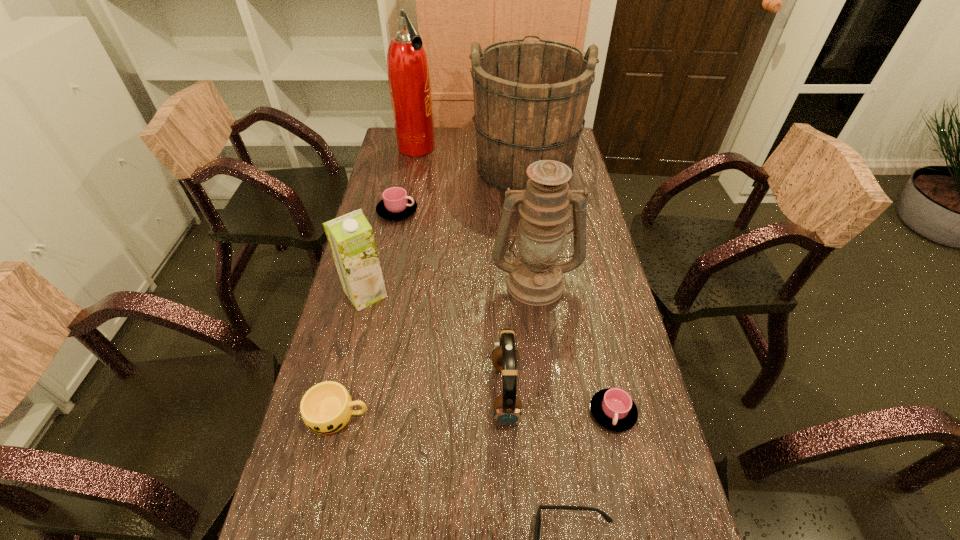
What are the coordinates of `the shortest cup` in the screenshot? It's located at (613, 408).

I want to click on the smaller pink cup, so click(613, 408).

Find the location of a particular element. blank space located 0.220m on the right of the fire extinguisher is located at coordinates (488, 148).

Locate an element on the screen. free space located on the back of the bucket is located at coordinates (520, 127).

Locate an element on the screen. The height and width of the screenshot is (540, 960). vacant space located on the back of the oil lamp is located at coordinates (526, 204).

Locate an element on the screen. free location located 0.060m on the right of the sixth shortest object is located at coordinates (408, 294).

Image resolution: width=960 pixels, height=540 pixels. I want to click on vacant space situated on the ear cup of the brown headset, so click(x=325, y=393).

Where is `free spot located 0.350m on the ear cup of the brown headset`? The height and width of the screenshot is (540, 960). free spot located 0.350m on the ear cup of the brown headset is located at coordinates (347, 393).

Identify the location of free space located 0.200m on the ear cup of the brown headset. The height and width of the screenshot is (540, 960). (409, 393).

Identify the location of free point located 0.150m on the side with the handle of the farther pink cup. The width and height of the screenshot is (960, 540). pyautogui.click(x=460, y=211).